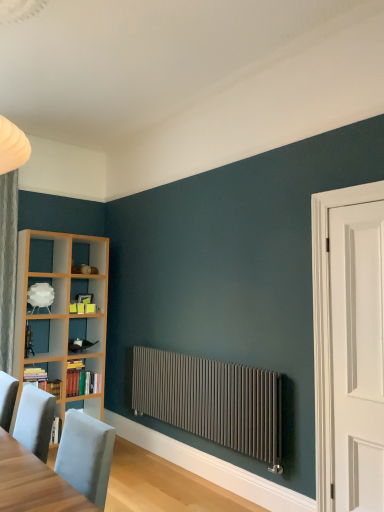
Question: Is the depth of white matte lampshade at left less than that of light gray wood table at lower left?

Choices:
 (A) no
 (B) yes

Answer: (A)

Question: From a real-world perspective, is white matte lampshade at left under light gray wood table at lower left?

Choices:
 (A) yes
 (B) no

Answer: (B)

Question: Is white matte lampshade at left taller than light gray wood table at lower left?

Choices:
 (A) no
 (B) yes

Answer: (A)

Question: From a real-world perspective, is white matte lampshade at left on light gray wood table at lower left?

Choices:
 (A) no
 (B) yes

Answer: (B)

Question: From the image's perspective, does white matte lampshade at left appear lower than light gray wood table at lower left?

Choices:
 (A) no
 (B) yes

Answer: (A)

Question: From the image's perspective, is white matte lampshade at left located above light gray wood table at lower left?

Choices:
 (A) no
 (B) yes

Answer: (B)

Question: From a real-world perspective, does white matte door at right stand above hardcover books at left, which is the 1th book in back-to-front order?

Choices:
 (A) no
 (B) yes

Answer: (B)

Question: Is white matte door at right facing towards hardcover books at left, which is the 1th book in back-to-front order?

Choices:
 (A) yes
 (B) no

Answer: (B)

Question: From the image's perspective, is white matte door at right beneath hardcover books at left, which is the 1th book in back-to-front order?

Choices:
 (A) no
 (B) yes

Answer: (A)

Question: Is white matte door at right to the right of hardcover books at left, which is the 1th book in back-to-front order, from the viewer's perspective?

Choices:
 (A) no
 (B) yes

Answer: (B)

Question: Does white matte door at right have a lesser height compared to hardcover books at left, acting as the second book starting from the front?

Choices:
 (A) no
 (B) yes

Answer: (A)

Question: Is white matte door at right taller than hardcover books at left, which is the 1th book in back-to-front order?

Choices:
 (A) no
 (B) yes

Answer: (B)

Question: Is matte gray radiator at center not near white matte lampshade at left?

Choices:
 (A) no
 (B) yes

Answer: (B)